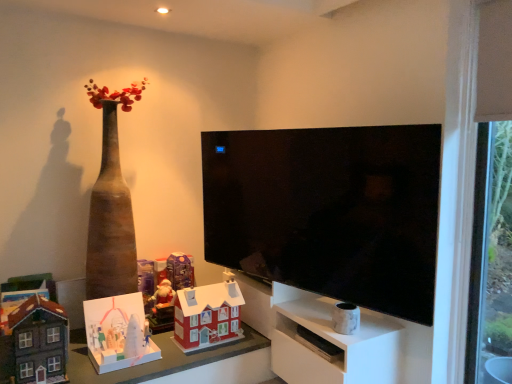
This screenshot has height=384, width=512. What do you see at coordinates (490, 259) in the screenshot? I see `transparent glass door at right` at bounding box center [490, 259].

The height and width of the screenshot is (384, 512). What do you see at coordinates (207, 316) in the screenshot?
I see `matte red plastic house at lower center, positioned as the 4th toy in left-to-right order` at bounding box center [207, 316].

The width and height of the screenshot is (512, 384). Describe the element at coordinates (35, 342) in the screenshot. I see `matte gray toy house at lower left, the fifth toy viewed from the right` at that location.

The height and width of the screenshot is (384, 512). Identify the location of matte cardboard table at lower center. (159, 359).

What do you see at coordinates (159, 359) in the screenshot? The image size is (512, 384). I see `matte cardboard table at lower center` at bounding box center [159, 359].

The height and width of the screenshot is (384, 512). What do you see at coordinates (180, 270) in the screenshot? I see `matte purple toy at center, the 3th toy positioned from the left` at bounding box center [180, 270].

This screenshot has height=384, width=512. Find the location of `white marble vase at lower right, placed as the fifth toy when sorted from left to right`. white marble vase at lower right, placed as the fifth toy when sorted from left to right is located at coordinates (345, 318).

Which object is more forward, white cardboard house at lower left, which is the second toy in left-to-right order, or black glossy tv at center?

black glossy tv at center is more forward.

Based on the photo, is white cardboard house at lower left, which is the second toy in left-to-right order, smaller than black glossy tv at center?

Yes.

Considering the sizes of white cardboard house at lower left, which is the second toy in left-to-right order, and black glossy tv at center in the image, is white cardboard house at lower left, which is the second toy in left-to-right order, wider or thinner than black glossy tv at center?

Considering their sizes, white cardboard house at lower left, which is the second toy in left-to-right order, looks broader than black glossy tv at center.

Can you confirm if white marble vase at lower right, which is counted as the 1th toy, starting from the right, is thinner than transparent glass door at right?

In fact, white marble vase at lower right, which is counted as the 1th toy, starting from the right, might be wider than transparent glass door at right.

From a real-world perspective, between white marble vase at lower right, which is counted as the 1th toy, starting from the right, and transparent glass door at right, who is vertically lower?

white marble vase at lower right, which is counted as the 1th toy, starting from the right, from a real-world perspective.

How distant is white marble vase at lower right, placed as the fifth toy when sorted from left to right, from transparent glass door at right?

white marble vase at lower right, placed as the fifth toy when sorted from left to right, and transparent glass door at right are 32.06 inches apart from each other.

Does white marble vase at lower right, placed as the fifth toy when sorted from left to right, turn towards transparent glass door at right?

No, white marble vase at lower right, placed as the fifth toy when sorted from left to right, does not turn towards transparent glass door at right.

From a real-world perspective, who is located lower, black glossy tv at center or white marble vase at lower right, which is counted as the 1th toy, starting from the right?

white marble vase at lower right, which is counted as the 1th toy, starting from the right, from a real-world perspective.

Does point (327, 132) come behind point (348, 327)?

No.

Considering the sizes of black glossy tv at center and white marble vase at lower right, placed as the fifth toy when sorted from left to right, in the image, is black glossy tv at center bigger or smaller than white marble vase at lower right, placed as the fifth toy when sorted from left to right,?

Clearly, black glossy tv at center is larger in size than white marble vase at lower right, placed as the fifth toy when sorted from left to right.

Which object is more forward, black glossy tv at center or white marble vase at lower right, which is counted as the 1th toy, starting from the right?

black glossy tv at center is in front.

From a real-world perspective, between matte purple toy at center, which ranks as the 3th toy in right-to-left order, and white marble vase at lower center, who is vertically higher?

matte purple toy at center, which ranks as the 3th toy in right-to-left order, is physically above.

Considering the relative sizes of matte purple toy at center, the 3th toy positioned from the left, and white marble vase at lower center in the image provided, is matte purple toy at center, the 3th toy positioned from the left, shorter than white marble vase at lower center?

Yes, matte purple toy at center, the 3th toy positioned from the left, is shorter than white marble vase at lower center.

From the image's perspective, is matte purple toy at center, which ranks as the 3th toy in right-to-left order, positioned above or below white marble vase at lower center?

matte purple toy at center, which ranks as the 3th toy in right-to-left order, is situated higher than white marble vase at lower center in the image.

Looking at their sizes, would you say matte purple toy at center, the 3th toy positioned from the left, is wider or thinner than white marble vase at lower center?

Considering their sizes, matte purple toy at center, the 3th toy positioned from the left, looks slimmer than white marble vase at lower center.

Which is behind, point (352, 306) or point (350, 362)?

The point (352, 306) is farther from the camera.

Does white marble vase at lower right, placed as the fifth toy when sorted from left to right, have a greater height compared to white marble vase at lower center?

No.

From a real-world perspective, who is located lower, white marble vase at lower right, which is counted as the 1th toy, starting from the right, or white marble vase at lower center?

white marble vase at lower center, from a real-world perspective.

Does white marble vase at lower right, which is counted as the 1th toy, starting from the right, have a lesser width compared to white marble vase at lower center?

Yes.

From a real-world perspective, is matte gray toy house at lower left, the fifth toy viewed from the right, located beneath matte red plastic house at lower center, marked as the second toy in a right-to-left arrangement?

No, from a real-world perspective, matte gray toy house at lower left, the fifth toy viewed from the right, is not under matte red plastic house at lower center, marked as the second toy in a right-to-left arrangement.

Considering the points (17, 376) and (191, 292), which point is behind, point (17, 376) or point (191, 292)?

The point (191, 292) is more distant.

Is matte gray toy house at lower left, the fifth toy viewed from the right, oriented towards matte red plastic house at lower center, marked as the second toy in a right-to-left arrangement?

No, matte gray toy house at lower left, the fifth toy viewed from the right, is not facing towards matte red plastic house at lower center, marked as the second toy in a right-to-left arrangement.

From a real-world perspective, which object rests below the other?

white cardboard house at lower left, which is the second toy in left-to-right order, from a real-world perspective.

Considering their positions, is matte gray toy house at lower left, the fifth toy viewed from the right, located in front of or behind white cardboard house at lower left, which is the second toy in left-to-right order?

matte gray toy house at lower left, the fifth toy viewed from the right, is in front of white cardboard house at lower left, which is the second toy in left-to-right order.

From the image's perspective, is matte gray toy house at lower left, the fifth toy viewed from the right, below white cardboard house at lower left, which is the second toy in left-to-right order?

No, from the image's perspective, matte gray toy house at lower left, the fifth toy viewed from the right, is not beneath white cardboard house at lower left, which is the second toy in left-to-right order.

Where is `the 2nd toy positioned above the white cardboard house at lower left, marked as the 4th toy in a right-to-left arrangement (from the image's perspective)`? The height and width of the screenshot is (384, 512). the 2nd toy positioned above the white cardboard house at lower left, marked as the 4th toy in a right-to-left arrangement (from the image's perspective) is located at coordinates (x=35, y=342).

Image resolution: width=512 pixels, height=384 pixels. I want to click on television that appears above the white cardboard house at lower left, marked as the 4th toy in a right-to-left arrangement (from a real-world perspective), so click(328, 211).

Locate an element on the screen. This screenshot has height=384, width=512. the 1st toy to the left of the transparent glass door at right, counting from the anchor's position is located at coordinates (345, 318).

Looking at the image, which one is located closer to black glossy tv at center, matte gray toy house at lower left, the fifth toy viewed from the right, or matte cardboard table at lower center?

matte cardboard table at lower center lies closer to black glossy tv at center than the other object.

Estimate the real-world distances between objects in this image. Which object is further from transparent glass door at right, matte gray toy house at lower left, the 1th toy in the left-to-right sequence, or white marble vase at lower right, which is counted as the 1th toy, starting from the right?

matte gray toy house at lower left, the 1th toy in the left-to-right sequence, is positioned further to the anchor transparent glass door at right.

When comparing their distances from transparent glass door at right, does matte gray toy house at lower left, the 1th toy in the left-to-right sequence, or matte red plastic house at lower center, marked as the second toy in a right-to-left arrangement, seem further?

Based on the image, matte gray toy house at lower left, the 1th toy in the left-to-right sequence, appears to be further to transparent glass door at right.

Looking at the image, which one is located closer to white marble vase at lower right, which is counted as the 1th toy, starting from the right, transparent glass door at right or matte red plastic house at lower center, marked as the second toy in a right-to-left arrangement?

Among the two, matte red plastic house at lower center, marked as the second toy in a right-to-left arrangement, is located nearer to white marble vase at lower right, which is counted as the 1th toy, starting from the right.

Looking at the image, which one is located further to white marble vase at lower center, white cardboard house at lower left, marked as the 4th toy in a right-to-left arrangement, or matte red plastic house at lower center, marked as the second toy in a right-to-left arrangement?

Among the two, white cardboard house at lower left, marked as the 4th toy in a right-to-left arrangement, is located further to white marble vase at lower center.

Which object lies nearer to the anchor point black glossy tv at center, matte cardboard table at lower center or matte gray toy house at lower left, the fifth toy viewed from the right?

matte cardboard table at lower center lies closer to black glossy tv at center than the other object.

Which object lies nearer to the anchor point black glossy tv at center, white marble vase at lower right, placed as the fifth toy when sorted from left to right, or matte gray toy house at lower left, the fifth toy viewed from the right?

white marble vase at lower right, placed as the fifth toy when sorted from left to right, lies closer to black glossy tv at center than the other object.

Based on their spatial positions, is black glossy tv at center or matte cardboard table at lower center closer to matte purple toy at center, the 3th toy positioned from the left?

matte cardboard table at lower center is closer to matte purple toy at center, the 3th toy positioned from the left.

Locate an element on the screen. television between matte cardboard table at lower center and white marble vase at lower right, placed as the fifth toy when sorted from left to right, in the horizontal direction is located at coordinates (328, 211).

Find the location of a particular element. television between matte gray toy house at lower left, the fifth toy viewed from the right, and transparent glass door at right, in the horizontal direction is located at coordinates (328, 211).

You are a GUI agent. You are given a task and a screenshot of the screen. Output one action in this format:
    pyautogui.click(x=<x>, y=<y>)
    Task: Click on the television located between matte cardboard table at lower center and transparent glass door at right in the left-right direction
    
    Given the screenshot: What is the action you would take?
    pyautogui.click(x=328, y=211)

You are a GUI agent. You are given a task and a screenshot of the screen. Output one action in this format:
    pyautogui.click(x=<x>, y=<y>)
    Task: Click on the television between matte red plastic house at lower center, marked as the second toy in a right-to-left arrangement, and white marble vase at lower right, which is counted as the 1th toy, starting from the right
    
    Given the screenshot: What is the action you would take?
    pyautogui.click(x=328, y=211)